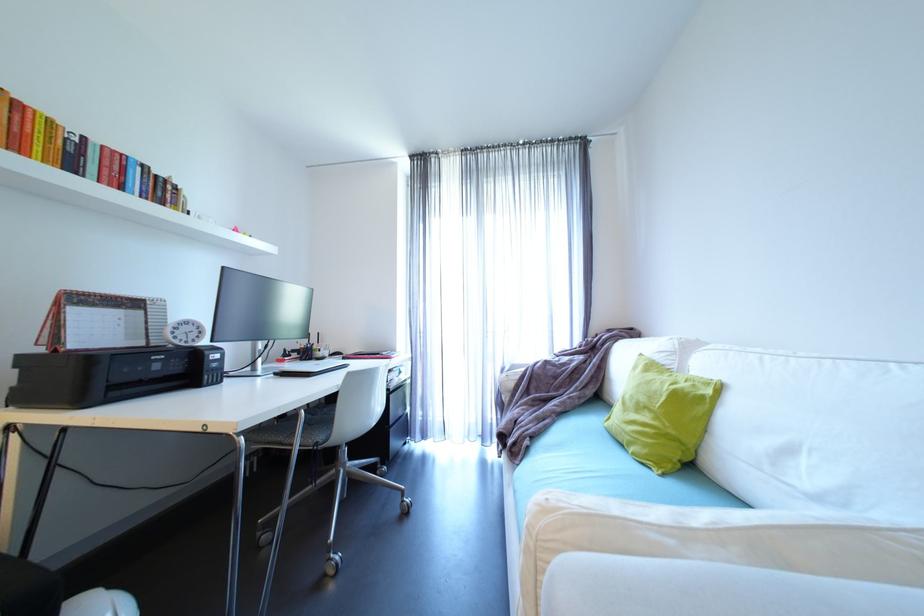
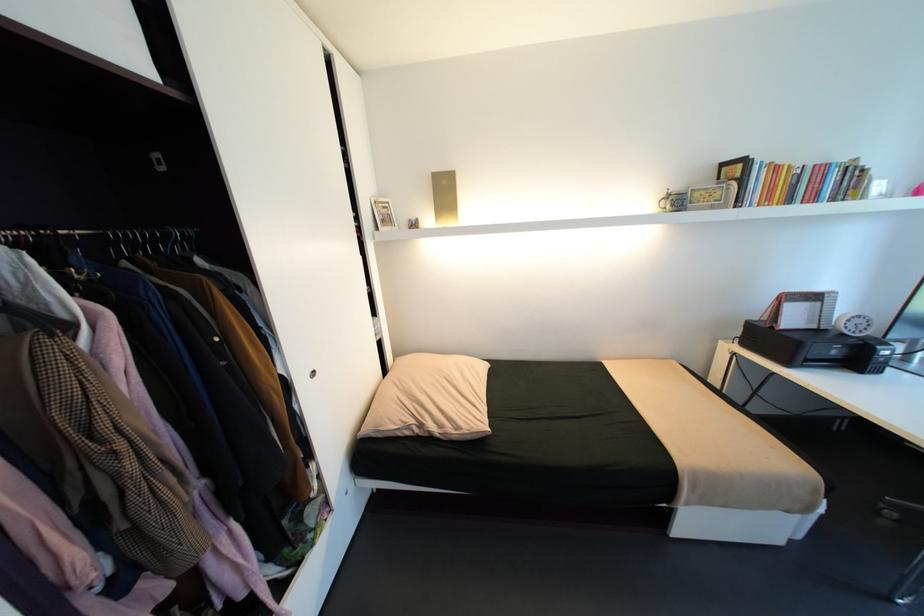
Find the pixel in the second image that matches point 64,351 in the first image.

(779, 328)